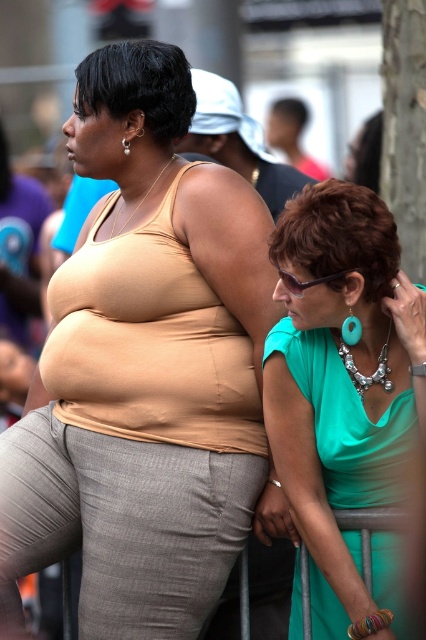
Question: Considering the relative positions of metallic gray rail at lower center and silver metallic earring at upper left in the image provided, where is metallic gray rail at lower center located with respect to silver metallic earring at upper left?

Choices:
 (A) left
 (B) right

Answer: (B)

Question: Which object is positioned farthest from the metallic gray rail at lower center?

Choices:
 (A) sunglasses at center
 (B) matte beige tank top at center
 (C) teal fabric dress at center

Answer: (A)

Question: Is metallic gray rail at lower center further to camera compared to silver metallic earring at upper left?

Choices:
 (A) no
 (B) yes

Answer: (A)

Question: Which point is farther to the camera?

Choices:
 (A) silver metallic earring at upper left
 (B) matte beige tank top at center

Answer: (A)

Question: Which point is farther to the camera?

Choices:
 (A) teal fabric dress at center
 (B) silver metallic earring at upper left
 (C) matte beige tank top at center

Answer: (B)

Question: Where is teal fabric dress at center located in relation to sunglasses at center in the image?

Choices:
 (A) above
 (B) below

Answer: (B)